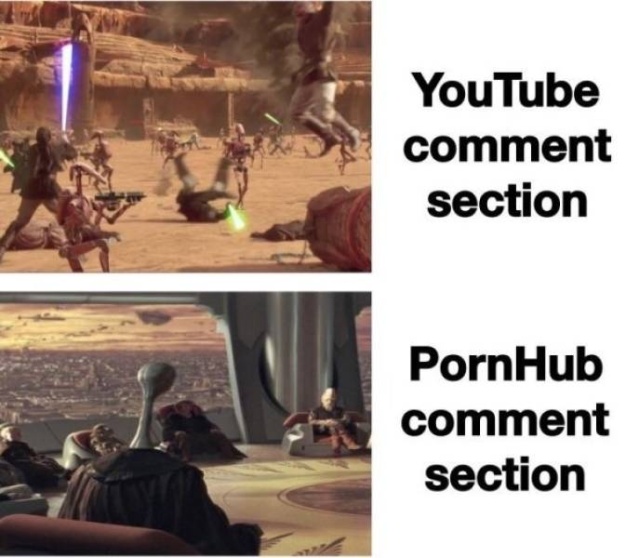
Locate an element on the screen. floor is located at coordinates (282, 488).